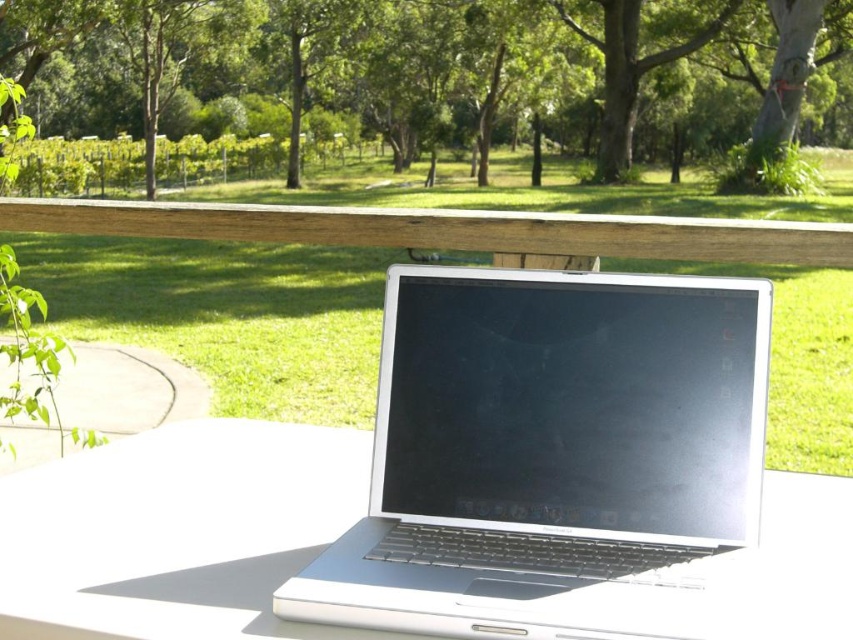
In the scene shown: You are sitting at the white glossy table at center and want to look at the green leafy tree at upper center. Which direction should you move to get a better view of it?

Since the green leafy tree at upper center is further to the viewer than the white glossy table at center, you should move backward to get a better view of it.